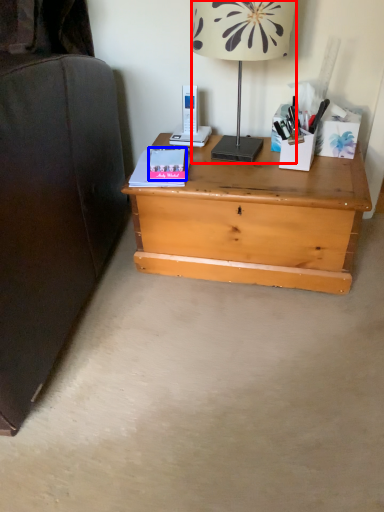
Question: Which object is further to the camera taking this photo, lamp (highlighted by a red box) or paperback book (highlighted by a blue box)?

Choices:
 (A) lamp
 (B) paperback book

Answer: (B)